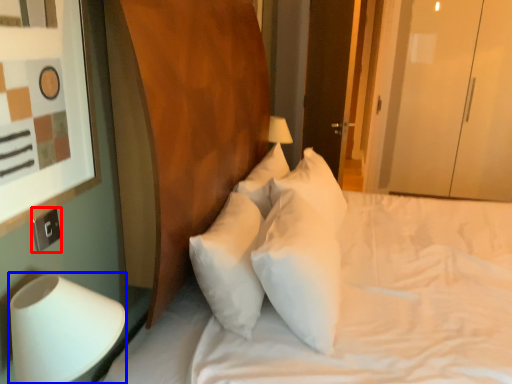
Question: Which object is closer to the camera taking this photo, electric outlet (highlighted by a red box) or table lamp (highlighted by a blue box)?

Choices:
 (A) electric outlet
 (B) table lamp

Answer: (B)